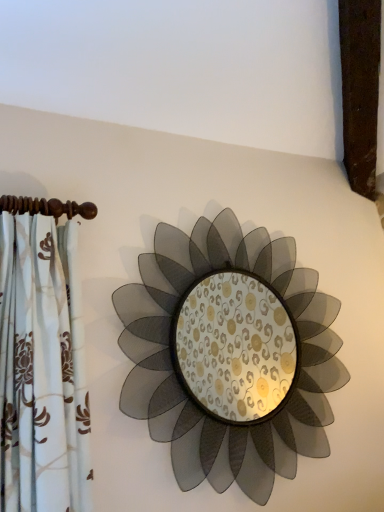
You are a GUI agent. You are given a task and a screenshot of the screen. Output one action in this format:
    pyautogui.click(x=<x>, y=<y>)
    Task: Click on the translucent plastic flower at center
    The height and width of the screenshot is (512, 384).
    Given the screenshot: What is the action you would take?
    pyautogui.click(x=187, y=390)

What do you see at coordinates (187, 390) in the screenshot?
I see `translucent plastic flower at center` at bounding box center [187, 390].

Locate an element on the screen. The height and width of the screenshot is (512, 384). translucent plastic flower at center is located at coordinates (187, 390).